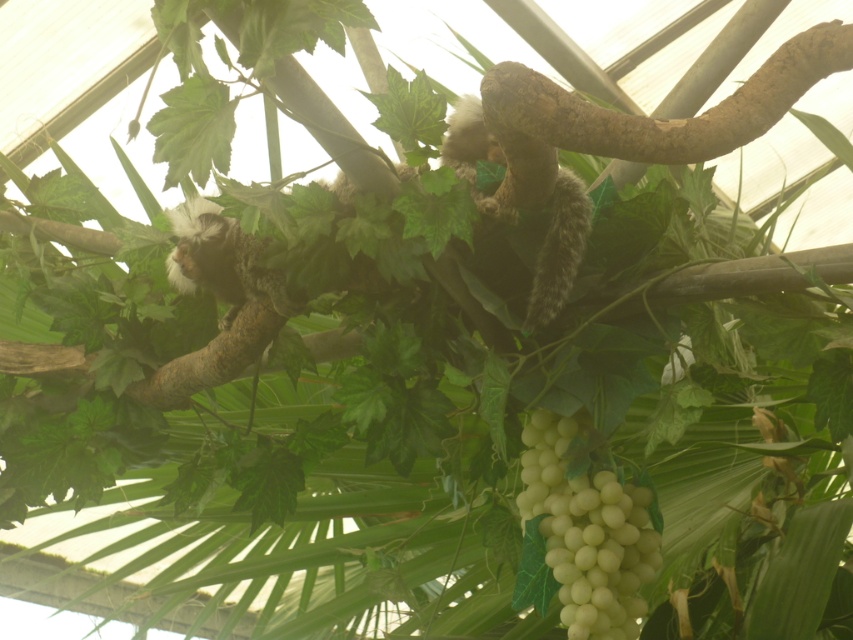
Question: Which point appears closest to the camera in this image?

Choices:
 (A) (592, 600)
 (B) (514, 108)

Answer: (B)

Question: Is brown rough tree branch at upper right wider than white matte grapes at lower right?

Choices:
 (A) yes
 (B) no

Answer: (A)

Question: Can you confirm if brown rough tree branch at upper right is smaller than white matte grapes at lower right?

Choices:
 (A) yes
 (B) no

Answer: (B)

Question: Does brown rough tree branch at upper right have a smaller size compared to white matte grapes at lower right?

Choices:
 (A) yes
 (B) no

Answer: (B)

Question: Which of the following is the farthest from the observer?

Choices:
 (A) white matte grapes at lower right
 (B) brown rough tree branch at upper right

Answer: (A)